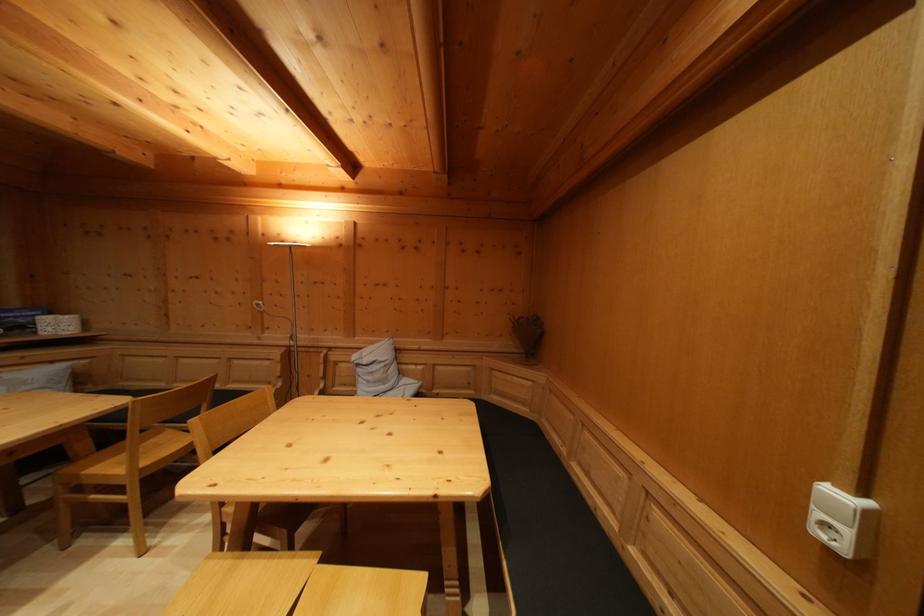
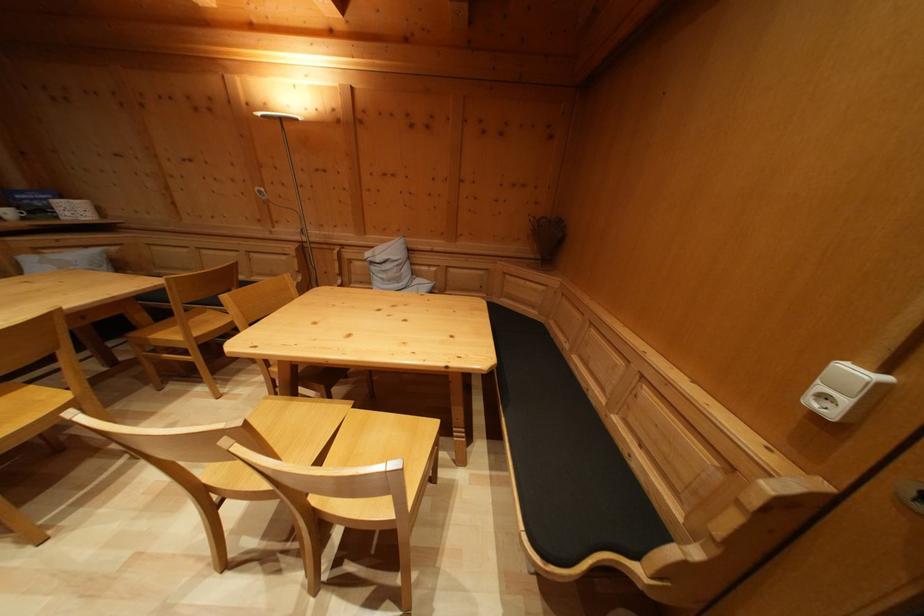
Find the pixel in the second image that matches the point at 325,560 in the first image.

(359, 408)